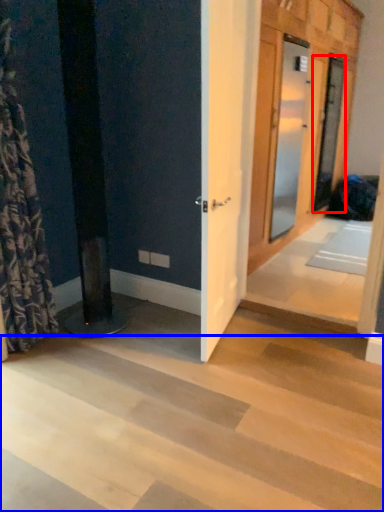
Question: Among these objects, which one is nearest to the camera, door (highlighted by a red box) or stairwell (highlighted by a blue box)?

Choices:
 (A) door
 (B) stairwell

Answer: (B)